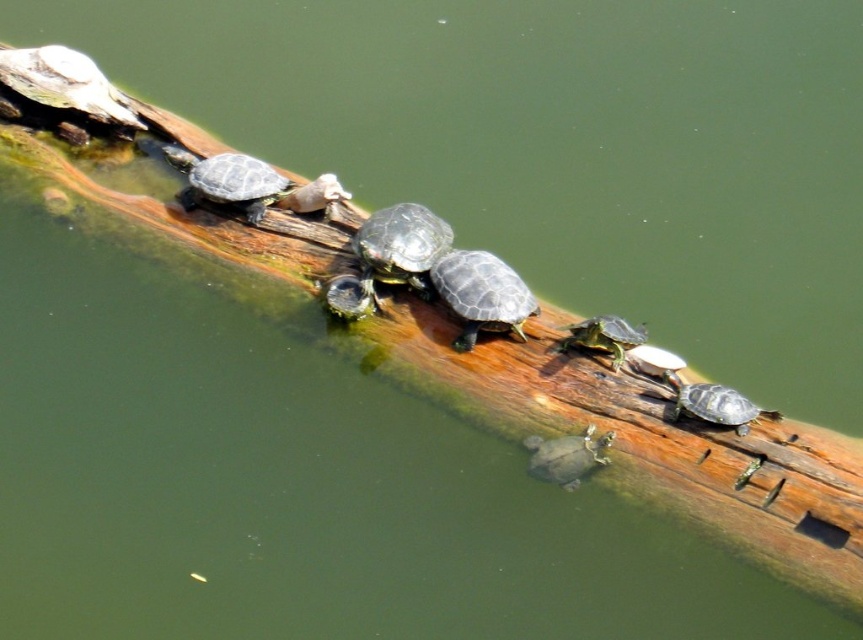
Question: Is smooth dark green tortoise at center positioned behind smooth gray tortoise at center?

Choices:
 (A) no
 (B) yes

Answer: (A)

Question: Can you confirm if smooth dark gray tortoise at center is smaller than green matte turtle at center?

Choices:
 (A) yes
 (B) no

Answer: (B)

Question: Which object is the farthest from the green matte turtle at center?

Choices:
 (A) smooth dark green tortoise at center
 (B) smooth gray tortoise at center
 (C) shiny dark green tortoise at center

Answer: (B)

Question: Based on their relative distances, which object is farther from the smooth dark gray tortoise at center?

Choices:
 (A) green matte turtle at center
 (B) smooth dark green tortoise at center

Answer: (B)

Question: Which is farther from the shiny dark green tortoise at upper center?

Choices:
 (A) smooth gray tortoise at center
 (B) smooth dark green tortoise at center

Answer: (A)

Question: Is shiny green tortoise at center to the left of green matte turtle at center from the viewer's perspective?

Choices:
 (A) yes
 (B) no

Answer: (B)